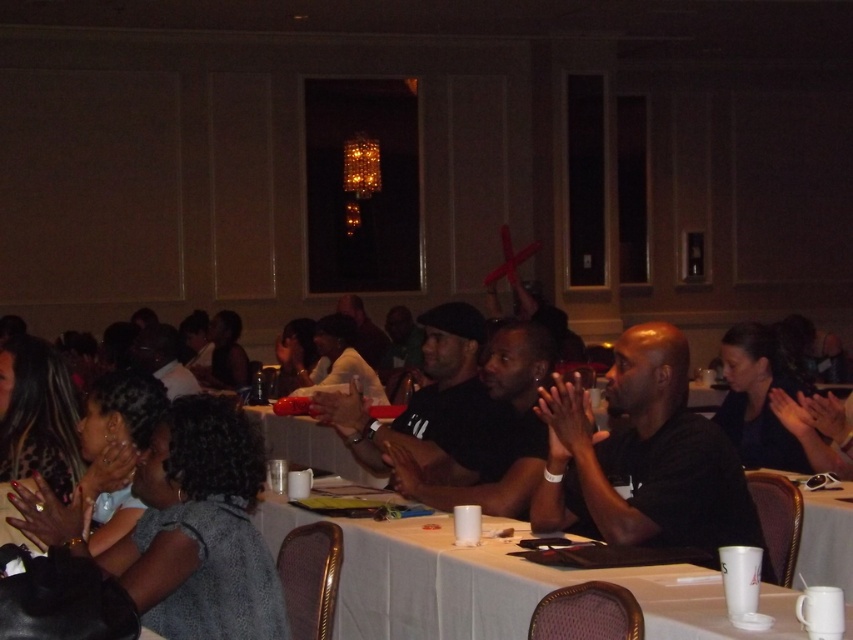
Which is below, white paper cup at lower right or matte plastic cup at center?

white paper cup at lower right is below.

Which is above, white paper cup at lower right or matte plastic cup at center?

Positioned higher is matte plastic cup at center.

This screenshot has height=640, width=853. I want to click on white paper cup at lower right, so click(804, 531).

Does black matte shirt at center have a lesser width compared to matte plastic cup at center?

Yes.

Based on the photo, who is higher up, black matte shirt at center or matte plastic cup at center?

black matte shirt at center

Which is behind, point (660, 392) or point (277, 451)?

The point (277, 451) is more distant.

Where is `black matte shirt at center`? black matte shirt at center is located at coordinates (643, 458).

Can you confirm if white paper cup at center is wider than matte plastic cup at center?

Yes.

Which of these two, white paper cup at center or matte plastic cup at center, stands shorter?

matte plastic cup at center is shorter.

Image resolution: width=853 pixels, height=640 pixels. In order to click on white paper cup at center in this screenshot , I will do [x=509, y=588].